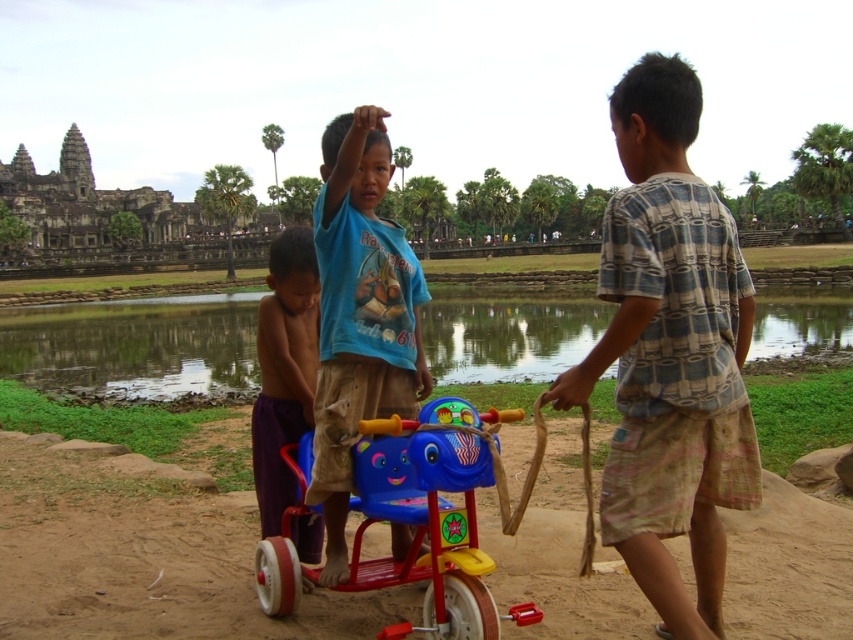
You are a photographer planning to take a picture of the brown dirt field at center and the plaid cotton shirt at right. Based on their positions, which object should you focus on first to ensure both are in frame?

The brown dirt field at center is positioned on the left side of plaid cotton shirt at right. To ensure both are in frame, focus on the brown dirt field at center first as it is closer to the left edge, then adjust to include the plaid cotton shirt at right on the right side.

You are a photographer planning to take a wide shot of the scene at Angkor Wat. You want to include both the brown dirt field at center and the plaid cotton shirt at right in your photo. Which object should you focus on to ensure both are in frame?

The brown dirt field at center is bigger than the plaid cotton shirt at right, so focusing on the brown dirt field at center will help ensure both objects are included in the wide shot.

You are a photographer planning to take a picture of the blue cotton shirt at center and the green reflective water at center. Which object will appear closer to the camera in the photo?

The green reflective water at center will appear closer to the camera because the blue cotton shirt at center is behind it.